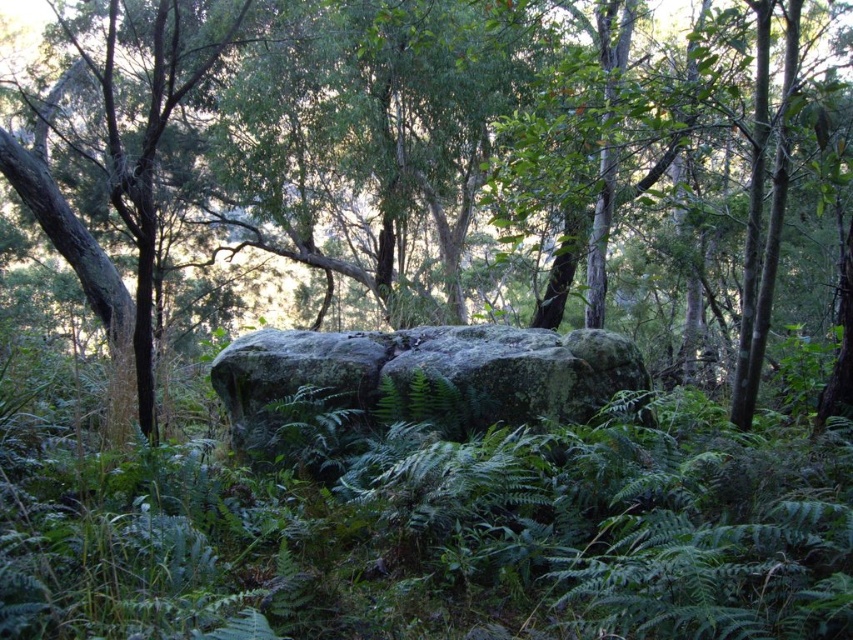
Question: Can you confirm if green mossy rock at center is bigger than green mossy boulder at center?

Choices:
 (A) no
 (B) yes

Answer: (B)

Question: Can you confirm if green mossy rock at center is smaller than green mossy boulder at center?

Choices:
 (A) no
 (B) yes

Answer: (A)

Question: Which point is farther from the camera taking this photo?

Choices:
 (A) (577, 90)
 (B) (550, 387)

Answer: (A)

Question: Which of the following is the closest to the observer?

Choices:
 (A) (212, 372)
 (B) (651, 113)

Answer: (A)

Question: Which point appears farthest from the camera in this image?

Choices:
 (A) (579, 388)
 (B) (339, 83)

Answer: (B)

Question: Does green mossy rock at center have a larger size compared to green mossy boulder at center?

Choices:
 (A) yes
 (B) no

Answer: (A)